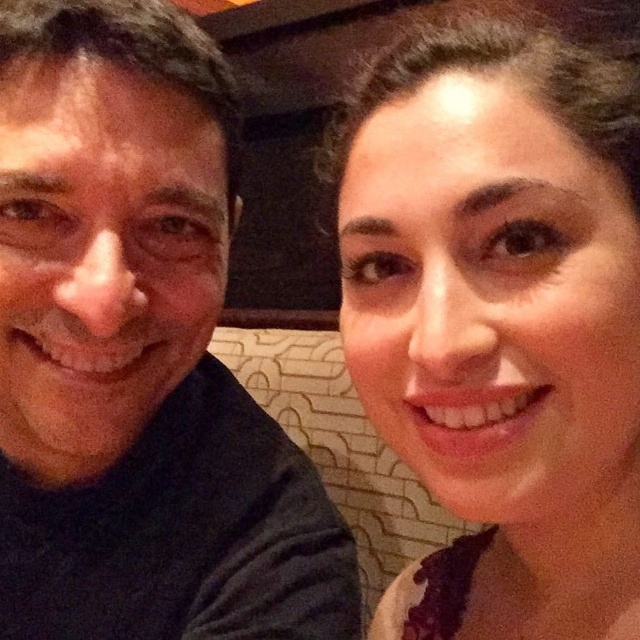
Question: Which point is closer to the camera taking this photo?

Choices:
 (A) (339, 605)
 (B) (371, 298)

Answer: (B)

Question: Does dark gray t-shirt at left appear on the left side of smooth skin face at upper right?

Choices:
 (A) no
 (B) yes

Answer: (B)

Question: Among these points, which one is nearest to the camera?

Choices:
 (A) (200, 257)
 (B) (518, 518)

Answer: (B)

Question: Which of the following is the farthest from the observer?

Choices:
 (A) dark gray t-shirt at left
 (B) smooth skin face at upper right

Answer: (A)

Question: Is dark gray t-shirt at left behind smooth skin face at upper right?

Choices:
 (A) yes
 (B) no

Answer: (A)

Question: Does dark gray t-shirt at left appear on the left side of smooth skin face at upper right?

Choices:
 (A) yes
 (B) no

Answer: (A)